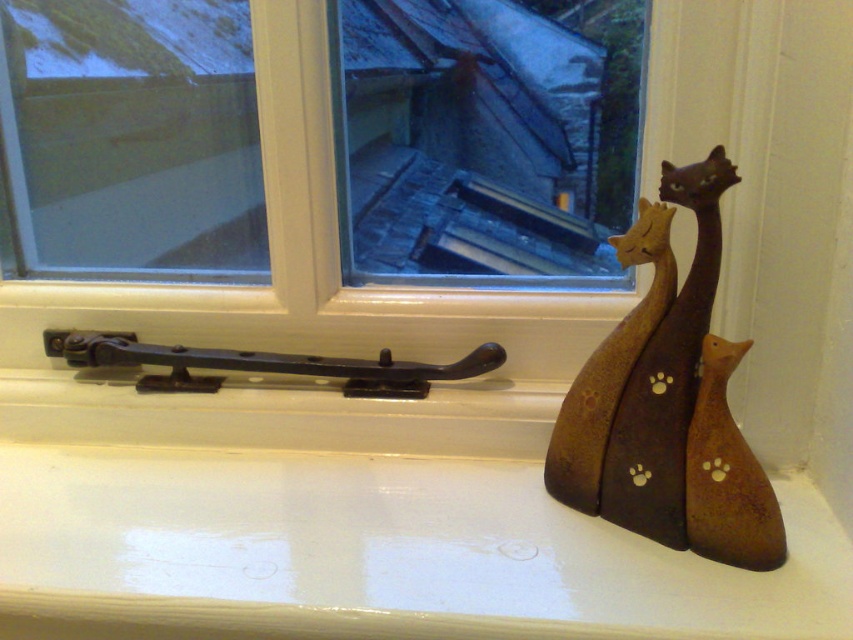
What do you see at coordinates (374, 554) in the screenshot? I see `white glossy window sill at lower right` at bounding box center [374, 554].

Does white glossy window sill at lower right have a greater height compared to brown matte wooden sculpture at right?

No, white glossy window sill at lower right is not taller than brown matte wooden sculpture at right.

Find the location of a particular element. This screenshot has height=640, width=853. white glossy window sill at lower right is located at coordinates (374, 554).

Is white plastic window frame at center smaller than white glossy window sill at lower right?

No, white plastic window frame at center is not smaller than white glossy window sill at lower right.

Based on the photo, who is positioned more to the right, white plastic window frame at center or white glossy window sill at lower right?

white glossy window sill at lower right

Who is more forward, [181,234] or [160,605]?

Point [160,605] is in front.

Identify the location of white plastic window frame at center. This screenshot has width=853, height=640. (314, 209).

Can you confirm if white plastic window frame at center is positioned above brown matte wooden sculpture at right?

Correct, white plastic window frame at center is located above brown matte wooden sculpture at right.

Is point (78, 260) closer to camera compared to point (640, 451)?

No, (78, 260) is further to viewer.

This screenshot has width=853, height=640. I want to click on white plastic window frame at center, so click(x=314, y=209).